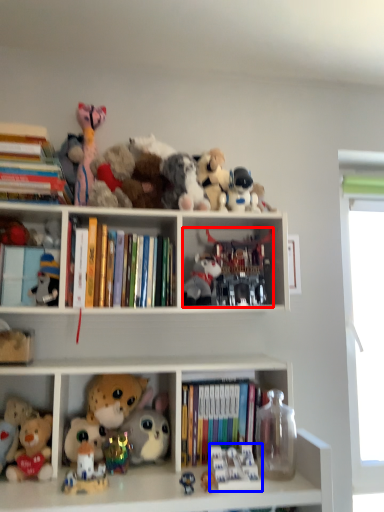
Question: Among these objects, which one is farthest to the camera, toy (highlighted by a red box) or toy (highlighted by a blue box)?

Choices:
 (A) toy
 (B) toy

Answer: (A)